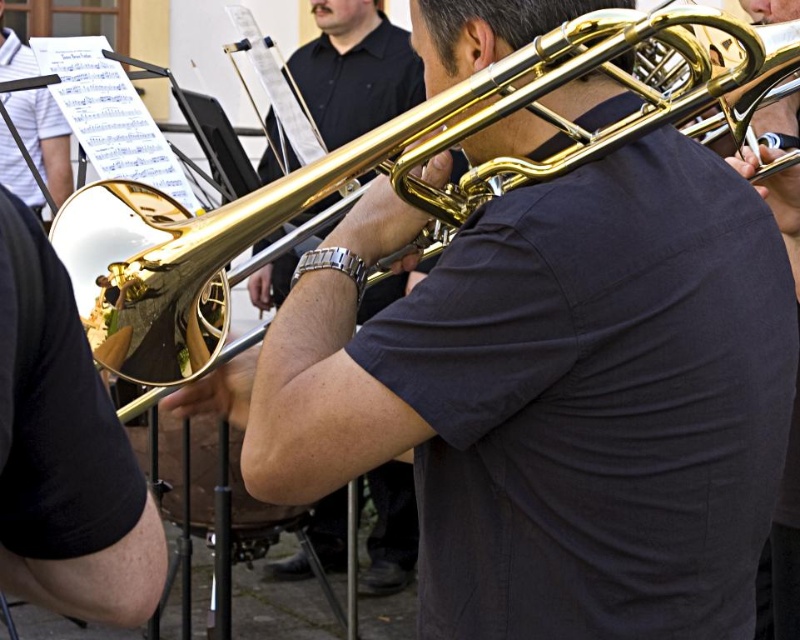
Does gold shiny trumpet at center appear under gold shiny trombone at center?

Yes.

Which is above, gold shiny trumpet at center or gold shiny trombone at center?

gold shiny trombone at center is higher up.

Is point (192, 296) positioned before point (332, 545)?

Yes.

Locate an element on the screen. The image size is (800, 640). gold shiny trumpet at center is located at coordinates (388, 179).

Does gold shiny trombone at center have a larger size compared to silver metallic watch at center?

Indeed, gold shiny trombone at center has a larger size compared to silver metallic watch at center.

Does gold shiny trombone at center appear under silver metallic watch at center?

No, gold shiny trombone at center is not below silver metallic watch at center.

Does point (354, 68) come closer to viewer compared to point (341, 262)?

No, (354, 68) is behind (341, 262).

Image resolution: width=800 pixels, height=640 pixels. What are the coordinates of `gold shiny trombone at center` in the screenshot? It's located at (356, 68).

Is point (574, 58) positioned behind point (358, 280)?

No, it is not.

Locate an element on the screen. This screenshot has width=800, height=640. gold shiny trumpet at center is located at coordinates (388, 179).